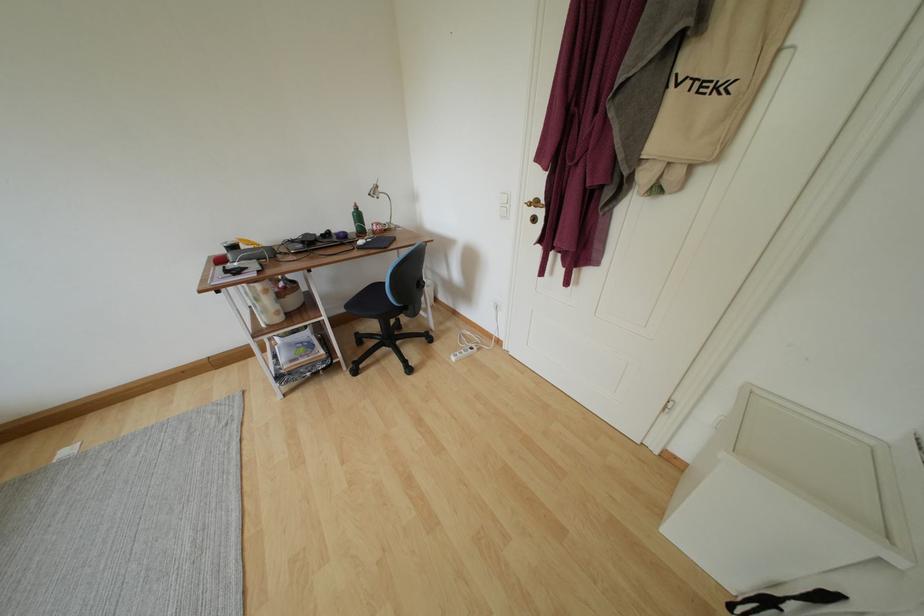
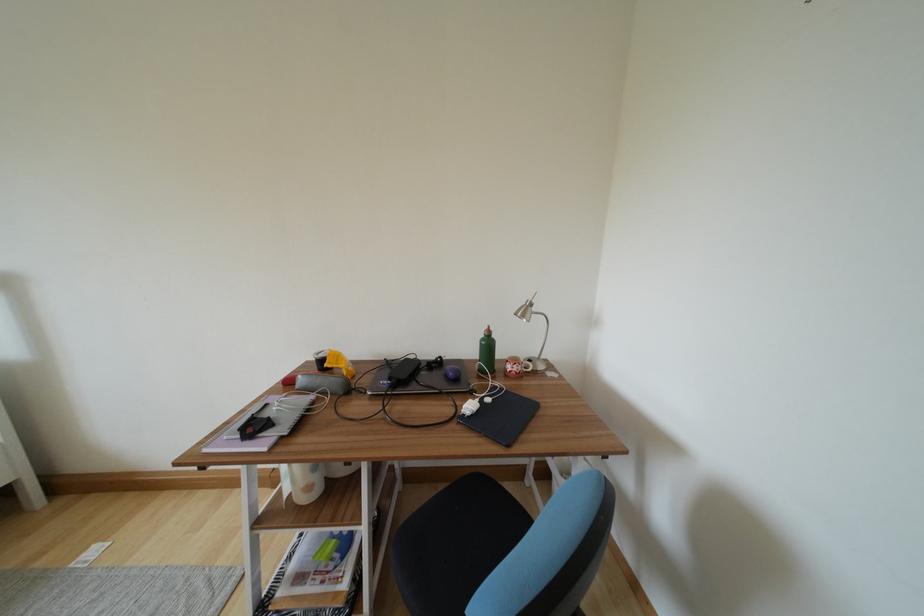
Find the pixel in the second image that matches point (339, 241) in the first image.

(448, 376)